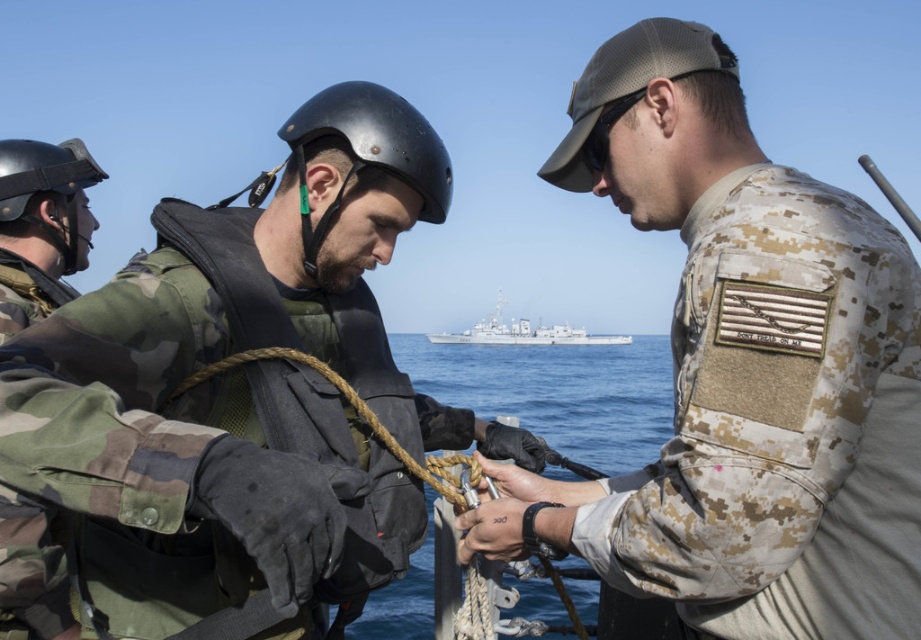
Does camouflage fabric jacket at center appear on the right side of black rubber goggles at center?

In fact, camouflage fabric jacket at center is to the left of black rubber goggles at center.

Is camouflage fabric jacket at center bigger than black rubber goggles at center?

Yes.

Is point (318, 413) positioned behind point (609, 129)?

Yes, it is.

In order to click on camouflage fabric jacket at center in this screenshot , I will do `click(236, 396)`.

Which of these two, camouflage fabric jacket at center or rope at center, stands taller?

rope at center

Is camouflage fabric jacket at center shorter than rope at center?

Indeed, camouflage fabric jacket at center has a lesser height compared to rope at center.

Does point (138, 419) come in front of point (648, 365)?

Yes, point (138, 419) is in front of point (648, 365).

Image resolution: width=921 pixels, height=640 pixels. In order to click on camouflage fabric jacket at center in this screenshot , I will do `click(236, 396)`.

Can you confirm if camouflage fabric jacket at center is taller than black matte helmet at left?

No.

Who is more distant from viewer, [210,342] or [6,221]?

Positioned behind is point [6,221].

Find the location of a particular element. Image resolution: width=921 pixels, height=640 pixels. camouflage fabric jacket at center is located at coordinates (236, 396).